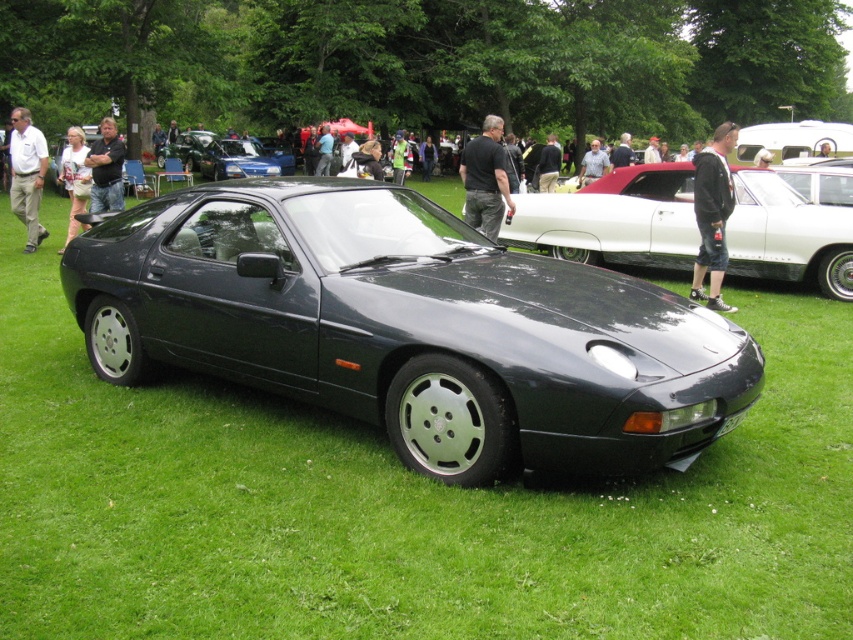
Question: Is black fabric shirt at center above denim jacket at center?

Choices:
 (A) no
 (B) yes

Answer: (B)

Question: Is satin black car at center thinner than light blue shirt at center?

Choices:
 (A) yes
 (B) no

Answer: (B)

Question: Can you confirm if denim jacket at center is positioned to the left of light blue shirt at center?

Choices:
 (A) yes
 (B) no

Answer: (A)

Question: Which of the following is the closest to the observer?

Choices:
 (A) satin black car at center
 (B) denim jacket at center
 (C) black fabric shirt at center

Answer: (A)

Question: Which of the following is the farthest from the observer?

Choices:
 (A) (492, 209)
 (B) (595, 145)
 (C) (62, 150)
 (D) (161, 150)

Answer: (D)

Question: Which object is positioned farthest from the black fabric shirt at center?

Choices:
 (A) black cotton hoodie at center
 (B) satin black car at center

Answer: (B)